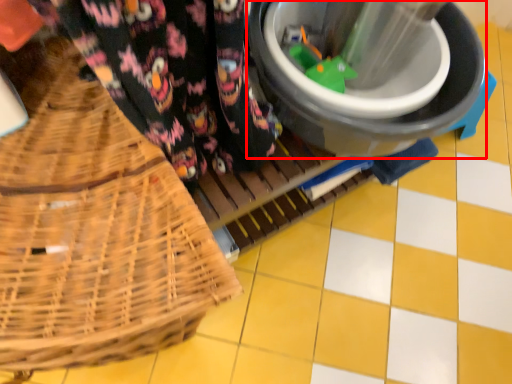
Question: From the image's perspective, what is the correct spatial relationship of appliance (annotated by the red box) in relation to picnic basket?

Choices:
 (A) above
 (B) below

Answer: (A)